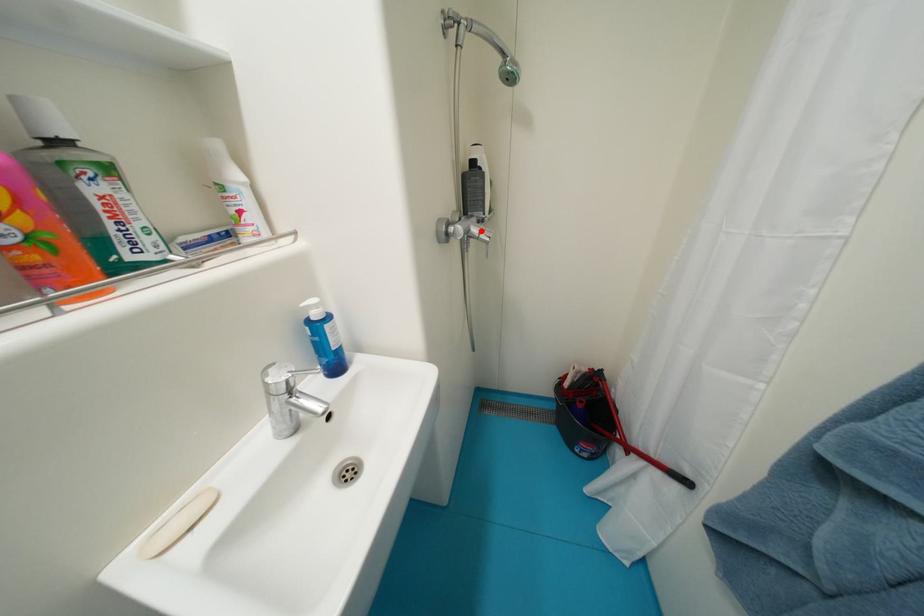
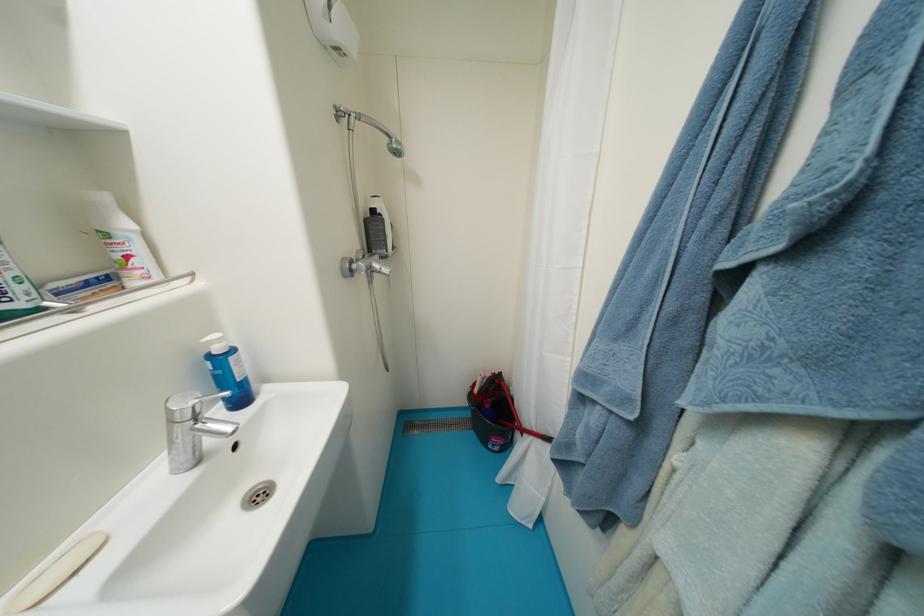
Find the pixel in the second image that matches the highlighted location in the first image.

(383, 267)